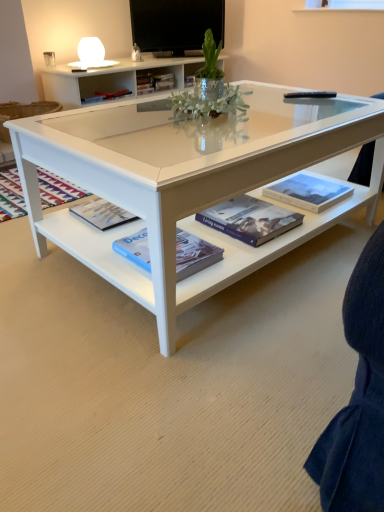
Question: Is hardcover book at center, which is the fourth book in right-to-left order, located within flat screen tv at upper center?

Choices:
 (A) no
 (B) yes

Answer: (A)

Question: Is flat screen tv at upper center to the right of hardcover book at center, the 1th book viewed from the back, from the viewer's perspective?

Choices:
 (A) yes
 (B) no

Answer: (A)

Question: From the image's perspective, is flat screen tv at upper center on top of hardcover book at center, which is the fourth book in right-to-left order?

Choices:
 (A) yes
 (B) no

Answer: (A)

Question: Is hardcover book at center, acting as the first book starting from the top, at the back of flat screen tv at upper center?

Choices:
 (A) no
 (B) yes

Answer: (A)

Question: Is flat screen tv at upper center bigger than hardcover book at center, the first book from the left?

Choices:
 (A) no
 (B) yes

Answer: (B)

Question: From a real-world perspective, relative to white glossy coffee table at center, is hardcover book at center, placed as the 3th book when sorted from top to bottom, vertically above or below?

Choices:
 (A) above
 (B) below

Answer: (A)

Question: In terms of width, does hardcover book at center, which is counted as the 2th book, starting from the right, look wider or thinner when compared to white glossy coffee table at center?

Choices:
 (A) thin
 (B) wide

Answer: (A)

Question: From the image's perspective, is hardcover book at center, marked as the 3th book in a back-to-front arrangement, located above or below white glossy coffee table at center?

Choices:
 (A) above
 (B) below

Answer: (B)

Question: Is point (213, 225) closer or farther from the camera than point (79, 165)?

Choices:
 (A) farther
 (B) closer

Answer: (A)

Question: In terms of width, does hardcover book at center, marked as the 3th book in a back-to-front arrangement, look wider or thinner when compared to flat screen tv at upper center?

Choices:
 (A) wide
 (B) thin

Answer: (A)

Question: Considering the positions of point [x=246, y=201] and point [x=147, y=10], is point [x=246, y=201] closer or farther from the camera than point [x=147, y=10]?

Choices:
 (A) farther
 (B) closer

Answer: (B)

Question: Considering the positions of hardcover book at center, which is counted as the 2th book, starting from the right, and flat screen tv at upper center in the image, is hardcover book at center, which is counted as the 2th book, starting from the right, bigger or smaller than flat screen tv at upper center?

Choices:
 (A) small
 (B) big

Answer: (A)

Question: From a real-world perspective, is hardcover book at center, marked as the 3th book in a back-to-front arrangement, above or below flat screen tv at upper center?

Choices:
 (A) above
 (B) below

Answer: (B)

Question: Looking at the image, does hardcover book at center, acting as the 4th book starting from the left, seem bigger or smaller compared to hardcover book at center, marked as the 3th book in a back-to-front arrangement?

Choices:
 (A) small
 (B) big

Answer: (B)

Question: From the image's perspective, is hardcover book at center, which appears as the second book when viewed from the back, positioned above or below hardcover book at center, the 2th book from the bottom?

Choices:
 (A) above
 (B) below

Answer: (A)